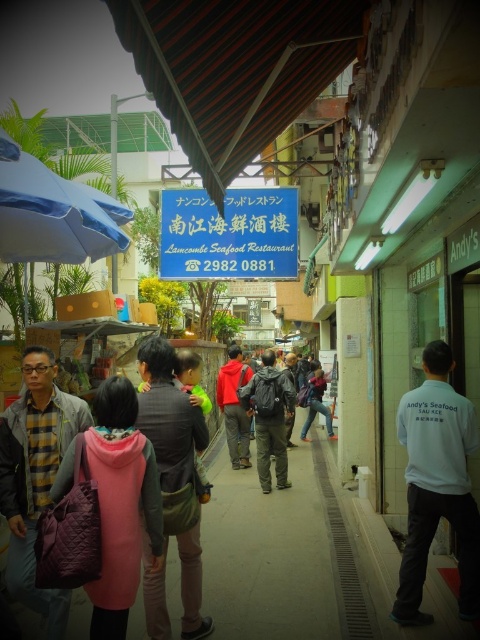
Question: Which of the following is the closest to the observer?

Choices:
 (A) blue plastic sign at center
 (B) red fleece jacket at center
 (C) denim jacket at center

Answer: (A)

Question: Is matte gray jacket at center below denim jacket at center?

Choices:
 (A) yes
 (B) no

Answer: (A)

Question: Which point is farther from the camera taking this photo?

Choices:
 (A) click(x=190, y=563)
 (B) click(x=228, y=376)

Answer: (B)

Question: Which point is farther from the camera taking this photo?

Choices:
 (A) (244, 372)
 (B) (460, 429)
 (C) (119, 396)

Answer: (A)

Question: Does white cotton shirt at right have a larger size compared to matte gray jacket at center?

Choices:
 (A) yes
 (B) no

Answer: (A)

Question: Does blue plastic sign at center appear under dark gray backpack at center?

Choices:
 (A) no
 (B) yes

Answer: (A)